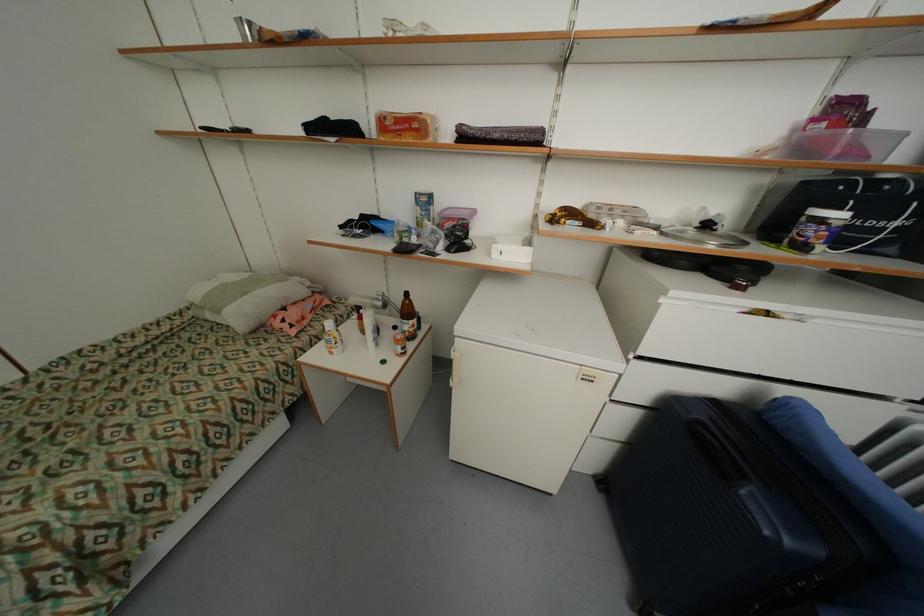
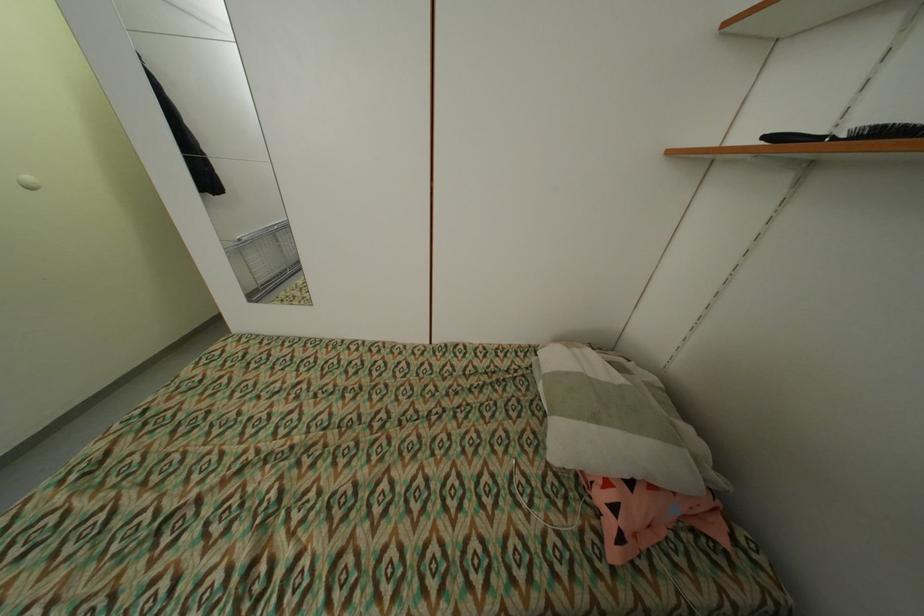
In the second image, find the point that corresponds to the point at 284,325 in the first image.

(606, 498)